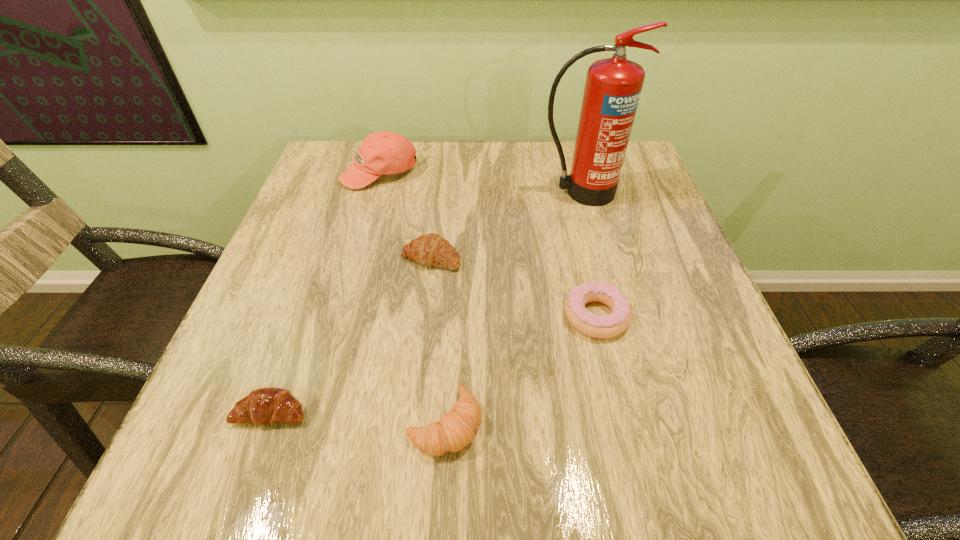
Find the location of a particular element. the tallest object is located at coordinates (613, 86).

Locate an element on the screen. The width and height of the screenshot is (960, 540). baseball cap is located at coordinates (385, 152).

Identify the location of the fourth nearest object. Image resolution: width=960 pixels, height=540 pixels. (430, 250).

Image resolution: width=960 pixels, height=540 pixels. Find the location of `doughnut`. doughnut is located at coordinates (599, 326).

Image resolution: width=960 pixels, height=540 pixels. Identify the location of the shortest object. (265, 406).

Identify the location of the leftmost crescent roll. (265, 406).

You are a GUI agent. You are given a task and a screenshot of the screen. Output one action in this format:
    pyautogui.click(x=<x>, y=<y>)
    Task: Click on the blank space located on the surface of the tallest object
    
    Given the screenshot: What is the action you would take?
    pyautogui.click(x=612, y=313)

Identify the location of vacant point located 0.340m on the front of the baseball cap. (345, 296).

I want to click on free space located on the left of the fourth nearest object, so click(271, 258).

At what (x,y) coordinates should I click in order to perform the action: click on free location located on the back of the third nearest object. Please return your answer as a coordinate pair (x, y). Looking at the image, I should click on (566, 188).